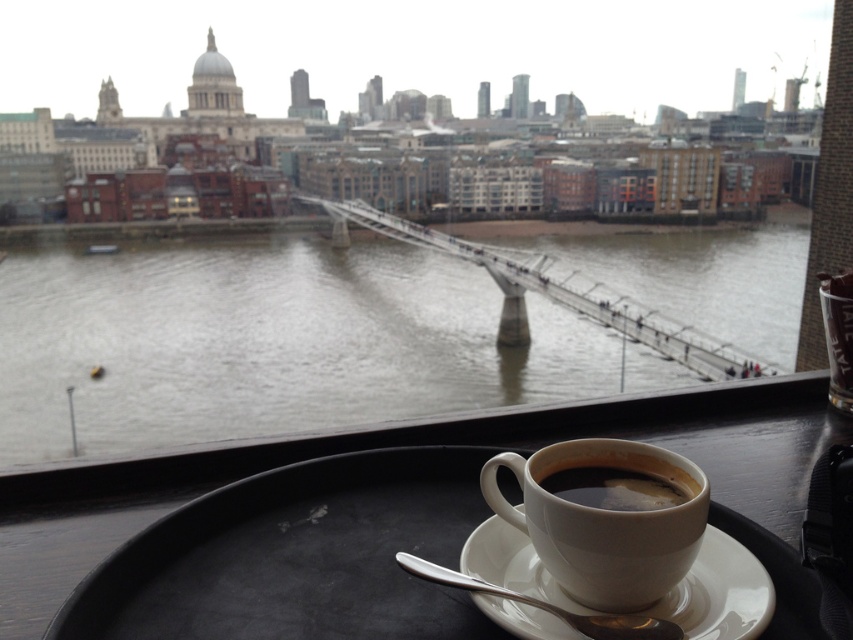
You are a barista who needs to place a new cup on the table. The table has limited space. You have the black matte tray at lower center and the white ceramic cup at center. Which object should you move to make room for the new cup?

You should move the black matte tray at lower center because it is to the left of the white ceramic cup at center, so moving it would free up space on the right side of the cup where the new cup can be placed.

You are a person sitting on the balcony and want to reach for the white ceramic cup at center and the brown water at center. Which object is closer to you?

The brown water at center is closer to you because the white ceramic cup at center is behind it.